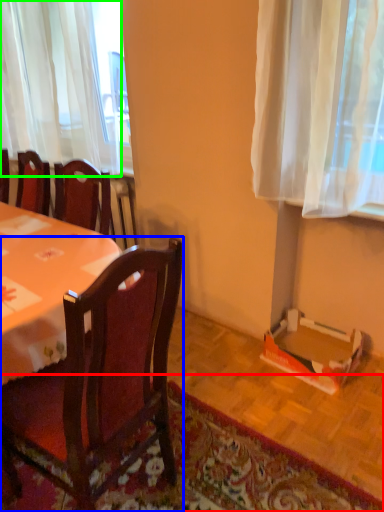
Question: Which object is the closest to the mat (highlighted by a red box)? Choose among these: chair (highlighted by a blue box) or curtain (highlighted by a green box).

Choices:
 (A) chair
 (B) curtain

Answer: (A)